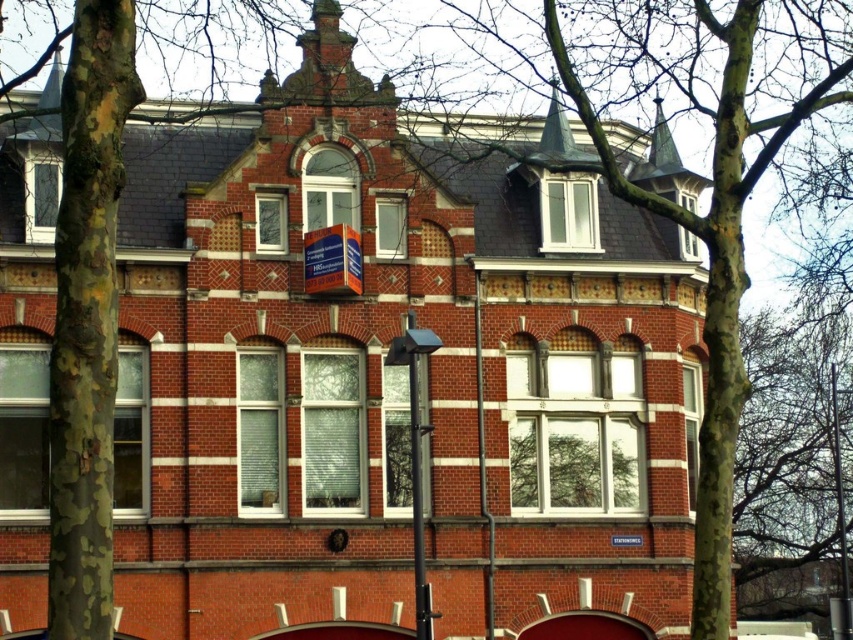
What do you see at coordinates (483, 465) in the screenshot? I see `black metal pole at center` at bounding box center [483, 465].

Is black metal pole at center bigger than metallic pole at right?

No, black metal pole at center is not bigger than metallic pole at right.

Is point (479, 428) positioned before point (834, 470)?

Yes.

In order to click on black metal pole at center in this screenshot , I will do `click(483, 465)`.